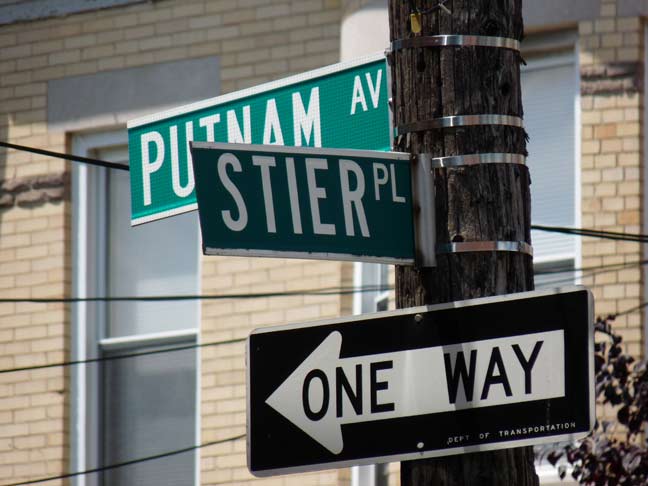
Image resolution: width=648 pixels, height=486 pixels. Identify the location of window. (143, 259), (166, 435), (558, 151).